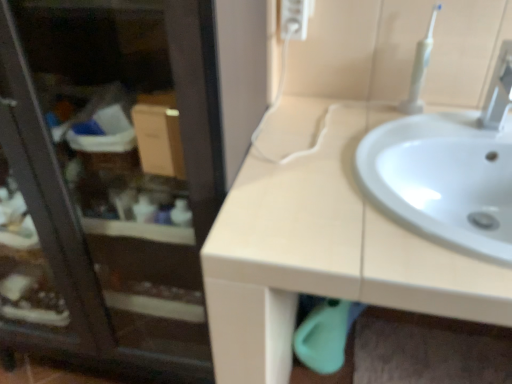
Question: Is point (x=484, y=110) positioned closer to the camera than point (x=272, y=203)?

Choices:
 (A) farther
 (B) closer

Answer: (A)

Question: Considering their positions, is white plastic tap at upper right located in front of or behind beige matte sink at upper right?

Choices:
 (A) front
 (B) behind

Answer: (B)

Question: Considering the real-world distances, which object is farthest from the transparent glass screen door at upper left?

Choices:
 (A) white plastic toothbrush at upper right
 (B) white plastic tap at upper right
 (C) white glossy sink at center
 (D) beige matte sink at upper right

Answer: (B)

Question: Considering the real-world distances, which object is closest to the transparent glass screen door at upper left?

Choices:
 (A) white glossy sink at center
 (B) white plastic toothbrush at upper right
 (C) beige matte sink at upper right
 (D) white plastic tap at upper right

Answer: (C)